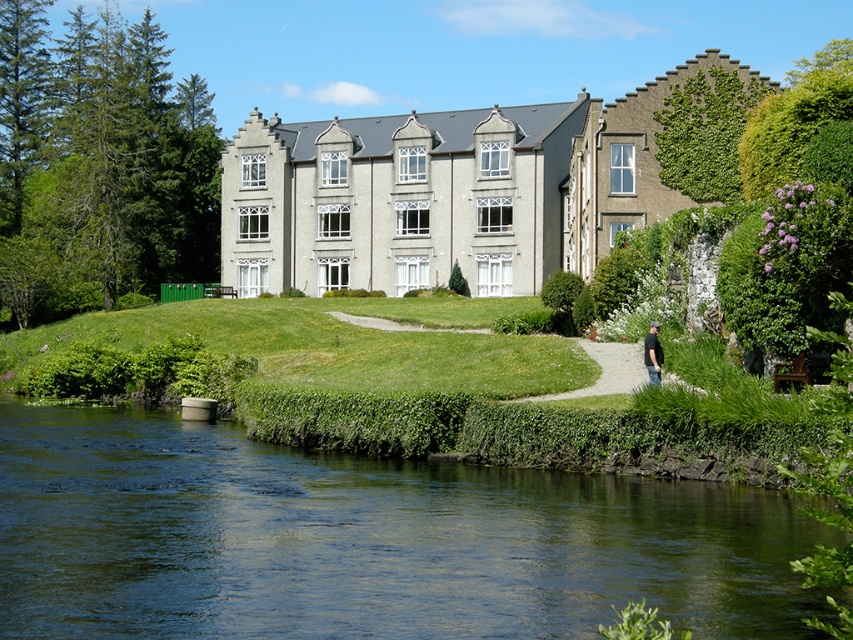
Question: Which of the following is the closest to the observer?

Choices:
 (A) green smooth water at lower center
 (B) black cotton shirt at lower right

Answer: (A)

Question: In this image, where is green smooth water at lower center located relative to black cotton shirt at lower right?

Choices:
 (A) right
 (B) left

Answer: (B)

Question: Which point is farther to the camera?

Choices:
 (A) (437, 563)
 (B) (643, 355)

Answer: (B)

Question: Is green smooth water at lower center to the left of black cotton shirt at lower right from the viewer's perspective?

Choices:
 (A) yes
 (B) no

Answer: (A)

Question: Does green smooth water at lower center come in front of black cotton shirt at lower right?

Choices:
 (A) no
 (B) yes

Answer: (B)

Question: Which point is closer to the camera taking this photo?

Choices:
 (A) (94, 484)
 (B) (654, 376)

Answer: (A)